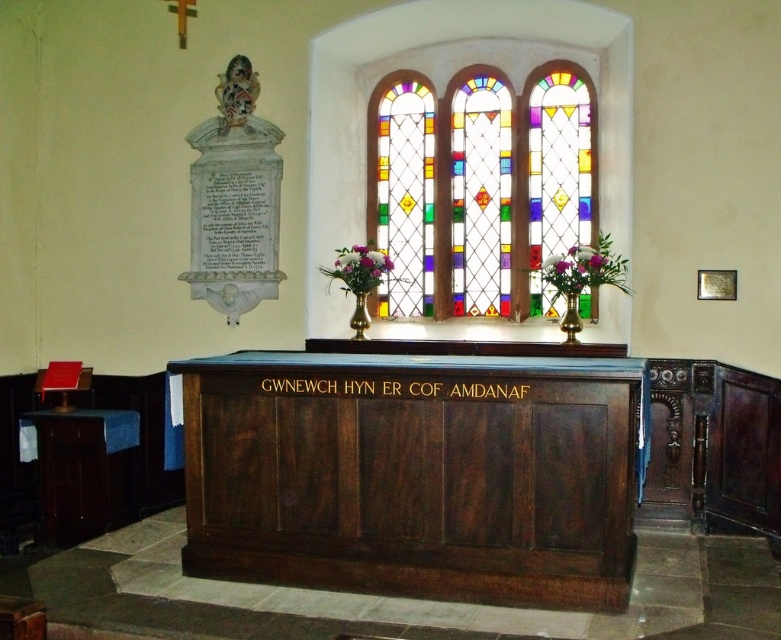
Question: Which object is farther from the camera taking this photo?

Choices:
 (A) stained glass at upper center
 (B) black wood sign at center
 (C) dark wood altar at center

Answer: (A)

Question: Does dark wood altar at center appear on the left side of black wood sign at center?

Choices:
 (A) no
 (B) yes

Answer: (A)

Question: Among these points, which one is farthest from the camera?

Choices:
 (A) (489, 273)
 (B) (286, 378)

Answer: (A)

Question: Can you confirm if dark wood altar at center is bigger than stained glass at upper center?

Choices:
 (A) yes
 (B) no

Answer: (B)

Question: Which of the following is the closest to the observer?

Choices:
 (A) dark wood altar at center
 (B) black wood sign at center
 (C) stained glass at upper center

Answer: (A)

Question: Is dark wood altar at center above black wood sign at center?

Choices:
 (A) yes
 (B) no

Answer: (B)